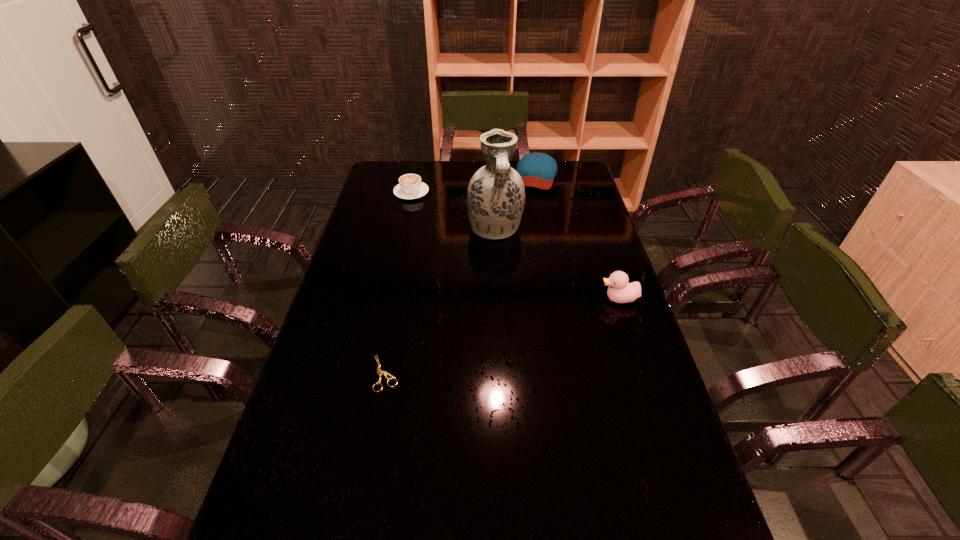
Identify the location of vacant region at the far right corner of the desktop. The image size is (960, 540). (578, 174).

I want to click on vacant space at the near right corner of the desktop, so click(670, 525).

At what (x,y) coordinates should I click in order to perform the action: click on vacant area between the nearest object and the tallest object. Please return your answer as a coordinate pair (x, y). Looking at the image, I should click on (440, 301).

Locate an element on the screen. Image resolution: width=960 pixels, height=540 pixels. vacant area that lies between the shortest object and the baseball cap is located at coordinates [460, 274].

At what (x,y) coordinates should I click in order to perform the action: click on empty space between the rightmost object and the baseball cap. Please return your answer as a coordinate pair (x, y). This screenshot has width=960, height=540. Looking at the image, I should click on (x=577, y=237).

The width and height of the screenshot is (960, 540). Find the location of `vacant point located between the second shortest object and the shears`. vacant point located between the second shortest object and the shears is located at coordinates (398, 283).

Where is `free space that is in between the baseball cap and the second tallest object`? The height and width of the screenshot is (540, 960). free space that is in between the baseball cap and the second tallest object is located at coordinates (577, 237).

Locate an element on the screen. This screenshot has height=540, width=960. vacant area between the duckling and the third shortest object is located at coordinates (577, 237).

Identify the location of free space between the shortest object and the rightmost object. (502, 336).

Locate an element on the screen. This screenshot has height=540, width=960. free space between the cappuccino and the nearest object is located at coordinates [x=398, y=283].